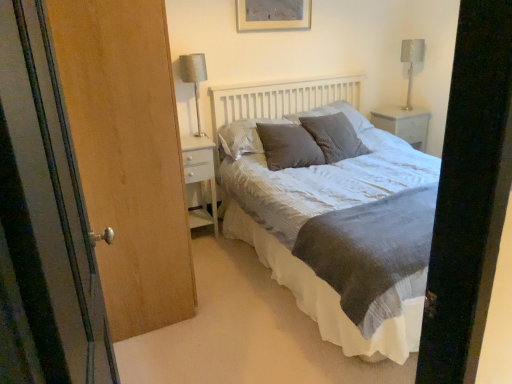
Question: Is matte gray picture frame at upper center at the right side of textured gray pillow at center, arranged as the first pillow when viewed from the left?

Choices:
 (A) yes
 (B) no

Answer: (A)

Question: Is there a large distance between matte gray picture frame at upper center and textured gray pillow at center, the 3th pillow when ordered from right to left?

Choices:
 (A) yes
 (B) no

Answer: (B)

Question: Is matte gray picture frame at upper center positioned beyond the bounds of textured gray pillow at center, the 3th pillow when ordered from right to left?

Choices:
 (A) yes
 (B) no

Answer: (A)

Question: Considering the relative sizes of matte gray picture frame at upper center and textured gray pillow at center, the 3th pillow when ordered from right to left, in the image provided, is matte gray picture frame at upper center bigger than textured gray pillow at center, the 3th pillow when ordered from right to left,?

Choices:
 (A) no
 (B) yes

Answer: (A)

Question: Is matte gray picture frame at upper center thinner than textured gray pillow at center, the 3th pillow when ordered from right to left?

Choices:
 (A) yes
 (B) no

Answer: (A)

Question: From the image's perspective, relative to gray textured pillow at center, acting as the 2th pillow starting from the right, is textured gray bed at center above or below?

Choices:
 (A) below
 (B) above

Answer: (A)

Question: Considering the positions of textured gray bed at center and gray textured pillow at center, which is the 2th pillow in left-to-right order, in the image, is textured gray bed at center wider or thinner than gray textured pillow at center, which is the 2th pillow in left-to-right order,?

Choices:
 (A) thin
 (B) wide

Answer: (B)

Question: Is textured gray bed at center in front of or behind gray textured pillow at center, which is the 2th pillow in left-to-right order, in the image?

Choices:
 (A) behind
 (B) front

Answer: (B)

Question: From a real-world perspective, is textured gray bed at center above or below gray textured pillow at center, acting as the 2th pillow starting from the right?

Choices:
 (A) above
 (B) below

Answer: (B)

Question: Looking at the image, does silver metallic table lamp at left, arranged as the first table lamp when viewed from the left, seem bigger or smaller compared to metallic silver table lamp at upper right, acting as the second table lamp starting from the left?

Choices:
 (A) small
 (B) big

Answer: (B)

Question: From the image's perspective, is silver metallic table lamp at left, which appears as the first table lamp when viewed from the front, positioned above or below metallic silver table lamp at upper right, the 1th table lamp when ordered from back to front?

Choices:
 (A) below
 (B) above

Answer: (A)

Question: Is silver metallic table lamp at left, which is the 2th table lamp in right-to-left order, in front of or behind metallic silver table lamp at upper right, placed as the 2th table lamp when sorted from front to back, in the image?

Choices:
 (A) behind
 (B) front

Answer: (B)

Question: Is silver metallic table lamp at left, which is the 2th table lamp in right-to-left order, taller or shorter than metallic silver table lamp at upper right, acting as the second table lamp starting from the left?

Choices:
 (A) tall
 (B) short

Answer: (A)

Question: In terms of size, does wooden screen door at left appear bigger or smaller than matte gray picture frame at upper center?

Choices:
 (A) big
 (B) small

Answer: (A)

Question: Is wooden screen door at left spatially inside matte gray picture frame at upper center, or outside of it?

Choices:
 (A) inside
 (B) outside

Answer: (B)